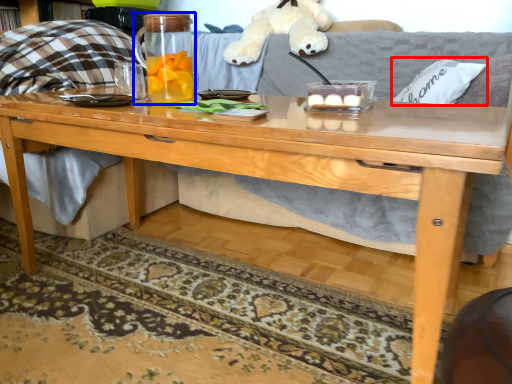
Question: Which object is closer to the camera taking this photo, pillow (highlighted by a red box) or beverage (highlighted by a blue box)?

Choices:
 (A) pillow
 (B) beverage

Answer: (B)